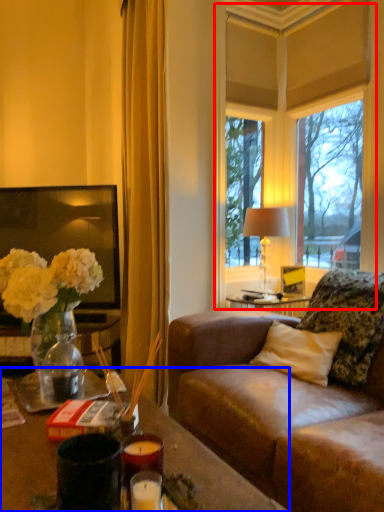
Question: Which point is further to the camera, window (highlighted by a red box) or desk (highlighted by a blue box)?

Choices:
 (A) window
 (B) desk

Answer: (A)